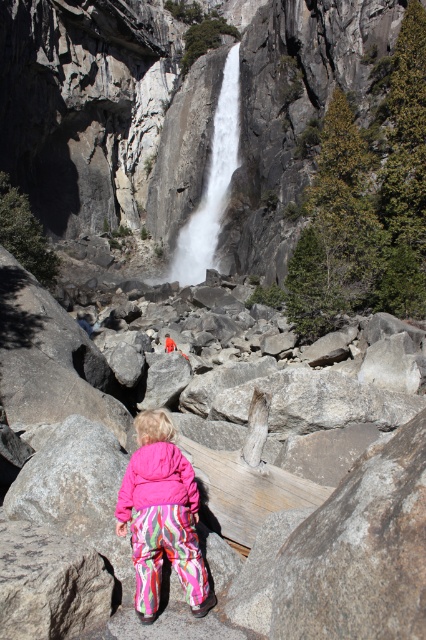
Question: Which point appears farthest from the camera in this image?

Choices:
 (A) (226, 184)
 (B) (181, 464)

Answer: (A)

Question: Is pink fleece jacket at center further to camera compared to white smooth waterfall at center?

Choices:
 (A) yes
 (B) no

Answer: (B)

Question: Is pink fleece jacket at center to the right of white smooth waterfall at center from the viewer's perspective?

Choices:
 (A) yes
 (B) no

Answer: (B)

Question: Which point is closer to the camera taking this photo?

Choices:
 (A) (210, 168)
 (B) (138, 509)

Answer: (B)

Question: Which of the following is the farthest from the observer?

Choices:
 (A) white smooth waterfall at center
 (B) pink fleece jacket at center

Answer: (A)

Question: Does pink fleece jacket at center appear on the left side of white smooth waterfall at center?

Choices:
 (A) yes
 (B) no

Answer: (A)